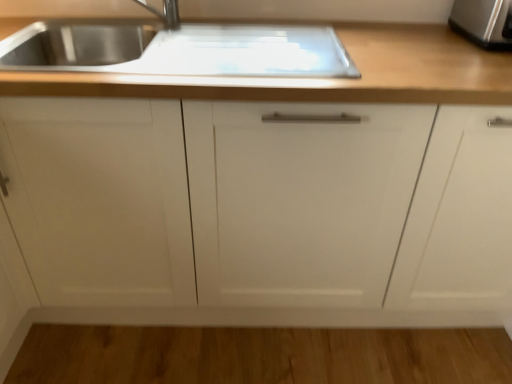
Question: Is stainless steel toaster at upper right to the right of wooden countertop at upper center from the viewer's perspective?

Choices:
 (A) yes
 (B) no

Answer: (A)

Question: Can you confirm if stainless steel toaster at upper right is taller than wooden countertop at upper center?

Choices:
 (A) yes
 (B) no

Answer: (B)

Question: From a real-world perspective, is stainless steel toaster at upper right under wooden countertop at upper center?

Choices:
 (A) yes
 (B) no

Answer: (B)

Question: Considering the relative sizes of stainless steel toaster at upper right and wooden countertop at upper center in the image provided, is stainless steel toaster at upper right smaller than wooden countertop at upper center?

Choices:
 (A) no
 (B) yes

Answer: (B)

Question: Does stainless steel toaster at upper right have a larger size compared to wooden countertop at upper center?

Choices:
 (A) yes
 (B) no

Answer: (B)

Question: Is white matte cabinet at center taller or shorter than wooden countertop at upper center?

Choices:
 (A) short
 (B) tall

Answer: (B)

Question: Relative to wooden countertop at upper center, is white matte cabinet at center in front or behind?

Choices:
 (A) behind
 (B) front

Answer: (B)

Question: From a real-world perspective, relative to wooden countertop at upper center, is white matte cabinet at center vertically above or below?

Choices:
 (A) above
 (B) below

Answer: (B)

Question: Considering the positions of white matte cabinet at center and wooden countertop at upper center in the image, is white matte cabinet at center bigger or smaller than wooden countertop at upper center?

Choices:
 (A) small
 (B) big

Answer: (B)

Question: From the image's perspective, is stainless steel toaster at upper right positioned above or below wooden countertop at upper center?

Choices:
 (A) below
 (B) above

Answer: (B)

Question: From a real-world perspective, relative to wooden countertop at upper center, is stainless steel toaster at upper right vertically above or below?

Choices:
 (A) below
 (B) above

Answer: (B)

Question: Considering the relative positions of stainless steel toaster at upper right and wooden countertop at upper center in the image provided, is stainless steel toaster at upper right to the left or to the right of wooden countertop at upper center?

Choices:
 (A) left
 (B) right

Answer: (B)

Question: Is stainless steel toaster at upper right bigger or smaller than wooden countertop at upper center?

Choices:
 (A) small
 (B) big

Answer: (A)

Question: Is point (335, 81) closer or farther from the camera than point (151, 119)?

Choices:
 (A) closer
 (B) farther

Answer: (A)

Question: Considering the positions of wooden countertop at upper center and white matte cabinet at center in the image, is wooden countertop at upper center wider or thinner than white matte cabinet at center?

Choices:
 (A) wide
 (B) thin

Answer: (B)